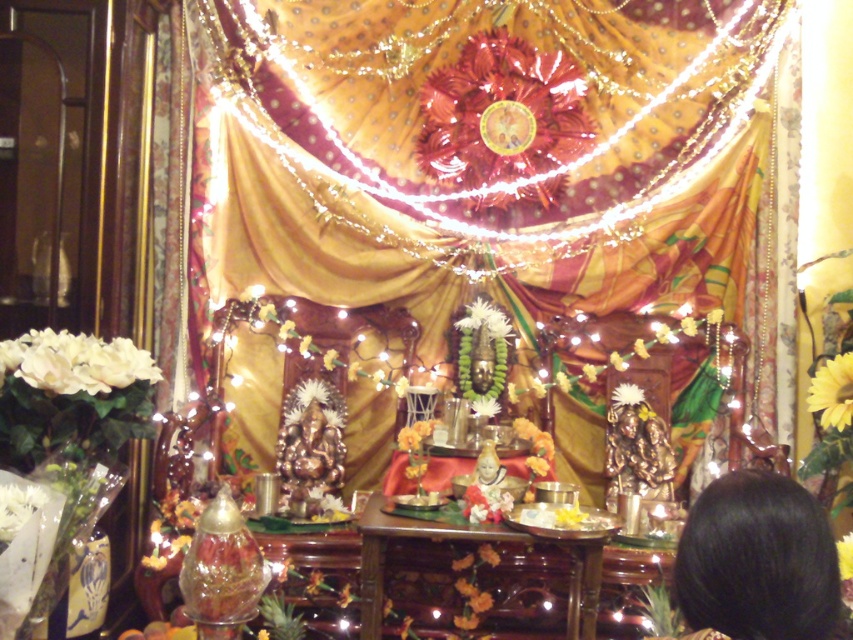
Is black hair at lower right taller than white matte flower at center?

Correct, black hair at lower right is much taller as white matte flower at center.

Who is shorter, black hair at lower right or white matte flower at center?

white matte flower at center

Describe the element at coordinates (757, 561) in the screenshot. This screenshot has width=853, height=640. I see `black hair at lower right` at that location.

Where is `black hair at lower right`? This screenshot has width=853, height=640. black hair at lower right is located at coordinates (757, 561).

Is white matte flowers at left thinner than yellow matte flower at upper right?

In fact, white matte flowers at left might be wider than yellow matte flower at upper right.

This screenshot has height=640, width=853. Describe the element at coordinates (74, 362) in the screenshot. I see `white matte flowers at left` at that location.

Where is `white matte flowers at left`? This screenshot has height=640, width=853. white matte flowers at left is located at coordinates coord(74,362).

Is the position of white matte flowers at left less distant than that of white matte flower at center?

Yes, it is in front of white matte flower at center.

Does white matte flowers at left come behind white matte flower at center?

No, white matte flowers at left is closer to the viewer.

The width and height of the screenshot is (853, 640). Find the location of `white matte flowers at left`. white matte flowers at left is located at coordinates (74, 362).